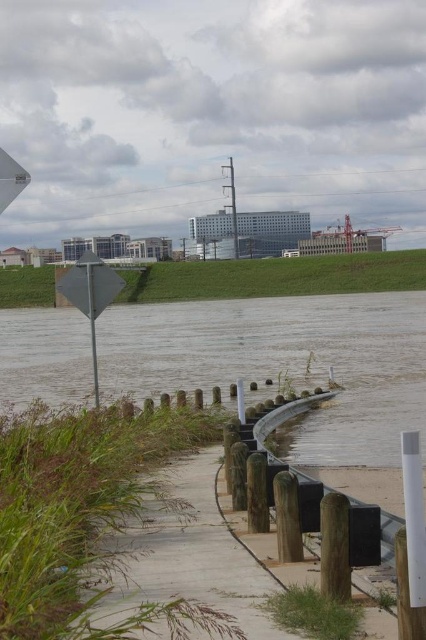
Is brown/rough water at lower center wider than metallic diamond-shaped sign at left?

Yes, brown/rough water at lower center is wider than metallic diamond-shaped sign at left.

Is brown/rough water at lower center thinner than metallic diamond-shaped sign at left?

No.

Does point (423, 410) lie behind point (80, 284)?

Yes, it is.

The height and width of the screenshot is (640, 426). I want to click on brown/rough water at lower center, so click(x=284, y=362).

Which is more to the right, metallic diamond-shaped sign at left or metallic sign at left?

metallic sign at left

Is the position of metallic diamond-shaped sign at left more distant than that of metallic sign at left?

Yes, metallic diamond-shaped sign at left is behind metallic sign at left.

Between point (69, 282) and point (89, 291), which one is positioned in front?

Point (89, 291) is in front.

Where is `metallic diamond-shaped sign at left`? metallic diamond-shaped sign at left is located at coordinates (91, 296).

Is brown/rough water at lower center shorter than metallic sign at left?

No, brown/rough water at lower center is not shorter than metallic sign at left.

Does brown/rough water at lower center appear on the left side of metallic sign at left?

Indeed, brown/rough water at lower center is positioned on the left side of metallic sign at left.

This screenshot has height=640, width=426. In order to click on brown/rough water at lower center in this screenshot , I will do pos(284,362).

The image size is (426, 640). I want to click on brown/rough water at lower center, so click(284, 362).